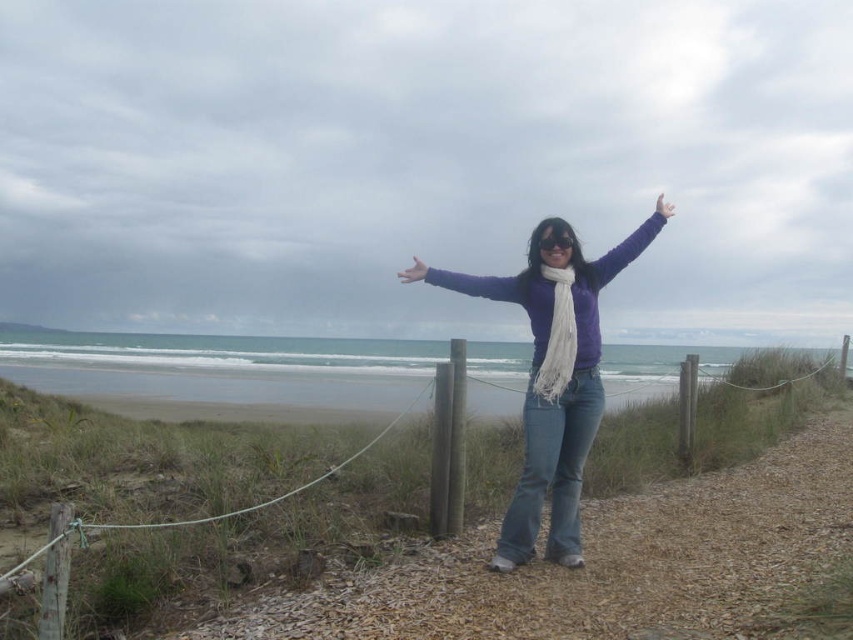
You are a photographer trying to capture the person in the image without any obstructions. The purple soft sweater at center and white soft scarf at center are both visible. Which item should you focus on to ensure it is fully in frame if your camera has a narrow field of view?

The purple soft sweater at center might be wider than the white soft scarf at center, so focusing on the purple soft sweater at center would ensure it fits within the narrow field of view better.

You are a photographer trying to capture the perfect shot of the white soft scarf at center and the matte white hand at upper right. Which object should you focus on first if you want to ensure both are in sharp focus, considering their distances from the camera?

The white soft scarf at center is shorter than the matte white hand at upper right, so you should focus on the matte white hand at upper right first to ensure both are in sharp focus.